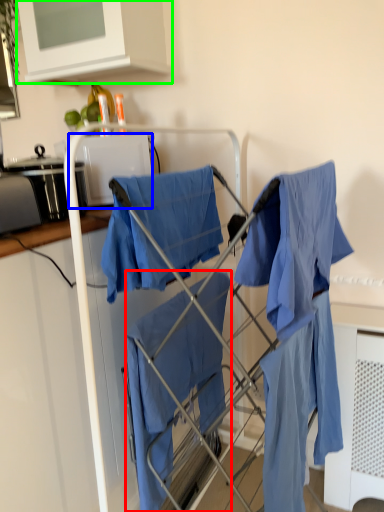
Question: Considering the real-world distances, which object is farthest from cloak (highlighted by a red box)? appliance (highlighted by a blue box) or cabinetry (highlighted by a green box)?

Choices:
 (A) appliance
 (B) cabinetry

Answer: (B)